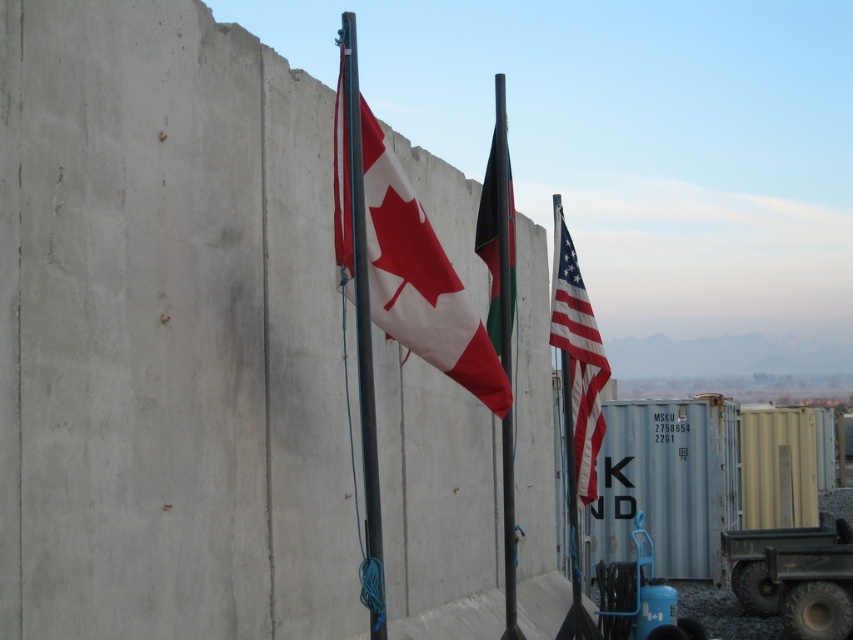
Question: Is matte fabric flag at center wider than red-white striped fabric flag at center?

Choices:
 (A) yes
 (B) no

Answer: (A)

Question: Which of the following is the farthest from the observer?

Choices:
 (A) (722, 492)
 (B) (381, 134)

Answer: (A)

Question: Among these objects, which one is farthest from the camera?

Choices:
 (A) metallic pole at center
 (B) green rubber trailer truck at lower right
 (C) matte fabric flag at center

Answer: (B)

Question: Considering the real-world distances, which object is closest to the green rubber trailer truck at lower right?

Choices:
 (A) rusty metal shipping container at center
 (B) matte fabric flag at center
 (C) red-white striped fabric flag at center
 (D) metallic pole at center

Answer: (A)

Question: Can you confirm if matte fabric flag at center is positioned to the right of red-white striped fabric flag at center?

Choices:
 (A) yes
 (B) no

Answer: (B)

Question: Does rusty metal shipping container at center come in front of metallic flag pole at center?

Choices:
 (A) yes
 (B) no

Answer: (B)